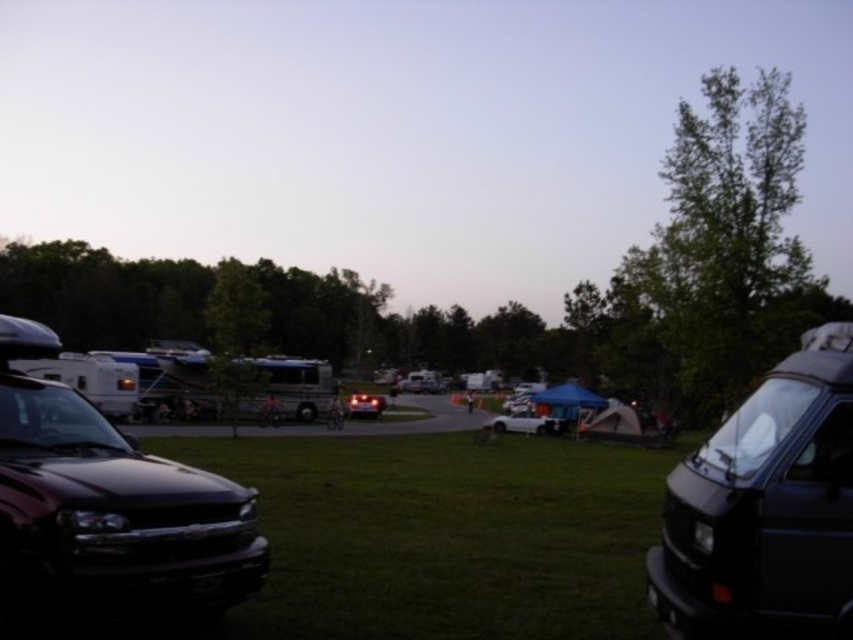
Question: Can you confirm if white matte car at center is bigger than matte black car at center?

Choices:
 (A) yes
 (B) no

Answer: (B)

Question: Considering the real-world distances, which object is farthest from the green grass at center?

Choices:
 (A) matte black car at center
 (B) white matte car at center

Answer: (A)

Question: Which of the following is the closest to the observer?

Choices:
 (A) (45, 499)
 (B) (541, 628)
 (C) (346, 404)

Answer: (A)

Question: Is shiny black suv at left above white matte car at center?

Choices:
 (A) yes
 (B) no

Answer: (A)

Question: Which point is closer to the camera?

Choices:
 (A) (312, 499)
 (B) (833, 528)
 (C) (35, 355)
 (D) (515, 412)

Answer: (B)

Question: Can you confirm if green grass at center is smaller than dark gray matte van at right?

Choices:
 (A) yes
 (B) no

Answer: (B)